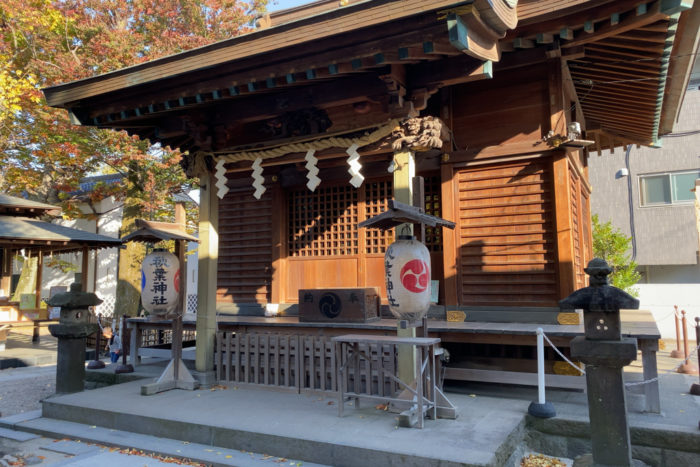
In order to click on white decorations in this screenshot , I will do `click(222, 183)`, `click(257, 180)`, `click(313, 176)`, `click(353, 172)`, `click(418, 284)`, `click(155, 289)`.